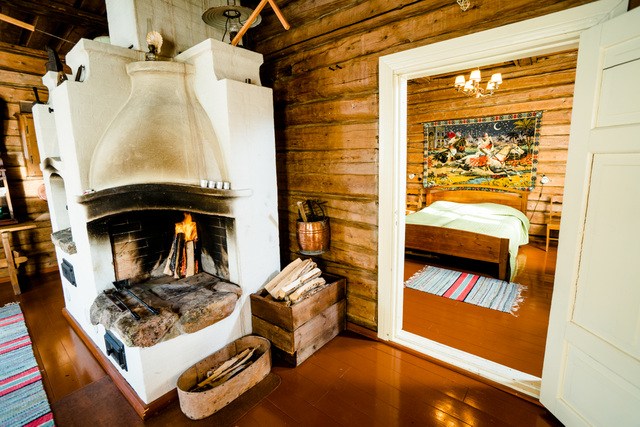
I want to click on hardwood flooring, so click(x=484, y=341).